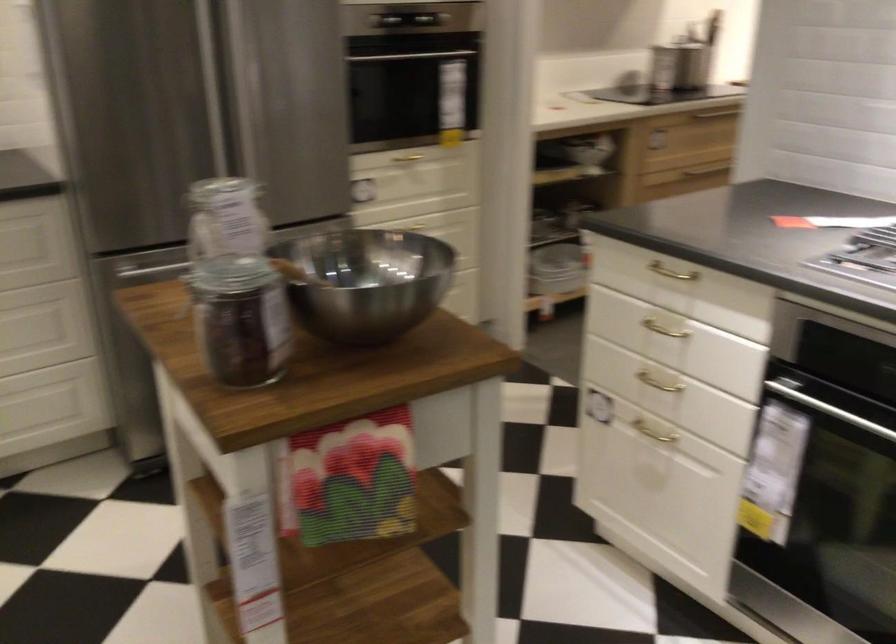
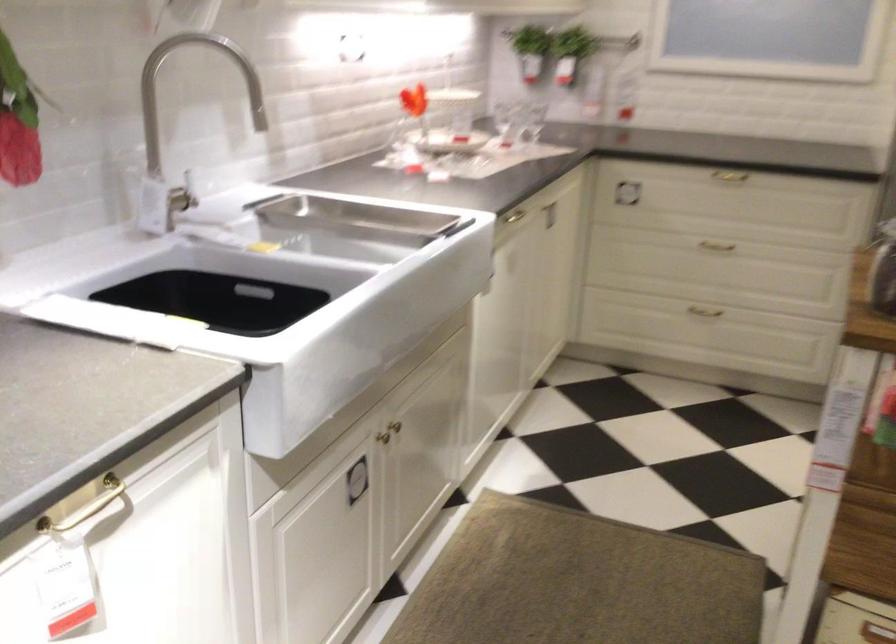
Question: The camera is either moving clockwise (left) or counter-clockwise (right) around the object. The first image is from the beginning of the video and the second image is from the end. Is the camera moving left or right when shooting the video?

Choices:
 (A) Left
 (B) Right

Answer: (B)